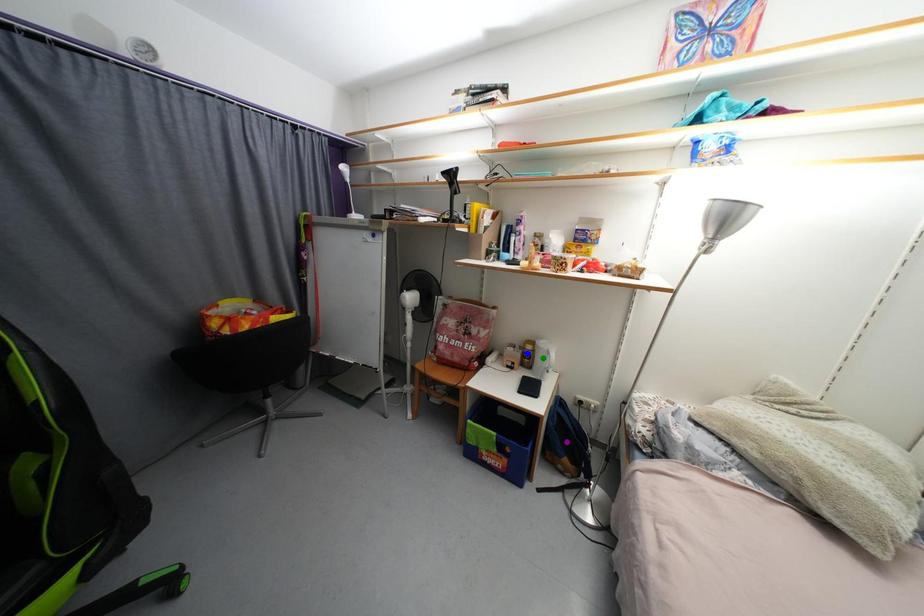
Looking at this image, order these from nearest to farthest:
purple point, green point, blue point

purple point, green point, blue point